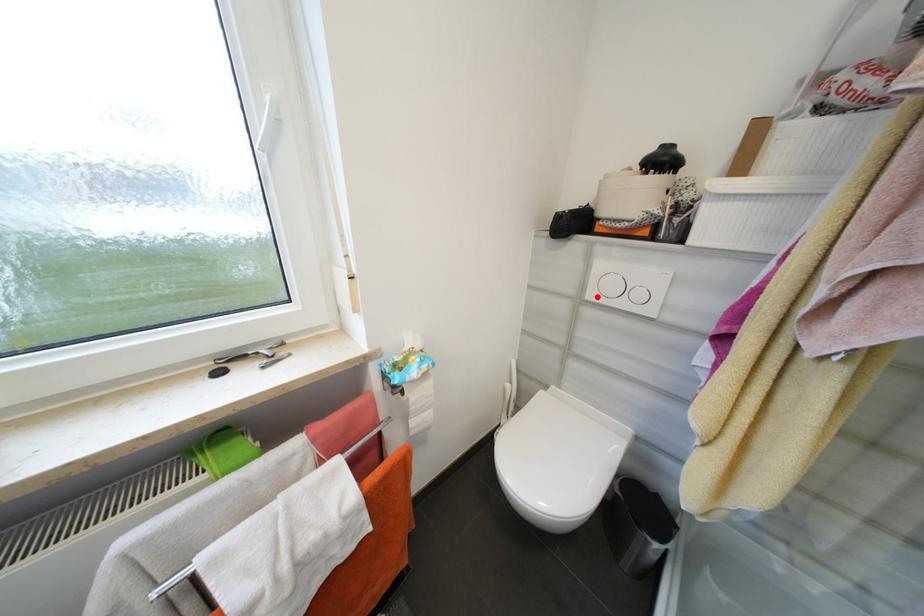
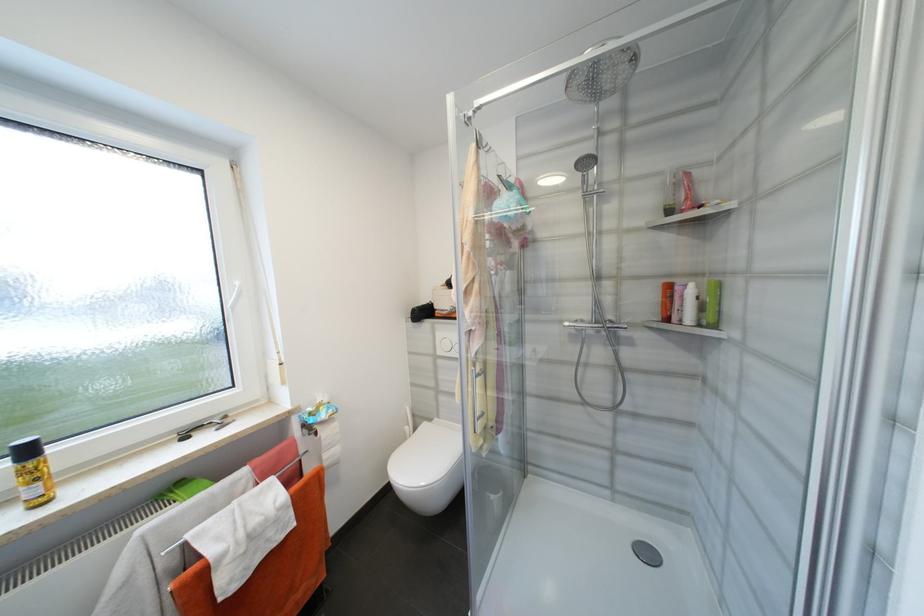
Question: I am providing you with two images of the same scene from different viewpoints. Given a red point in image1, look at the same physical point in image2. Is it:

Choices:
 (A) Closer to the viewpoint
 (B) Farther from the viewpoint

Answer: (B)